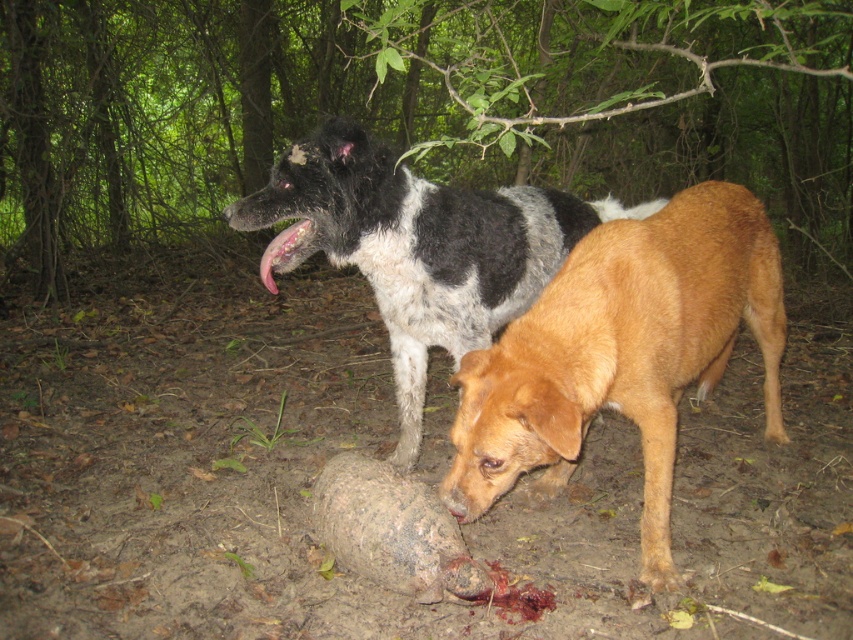
Who is positioned more to the right, green leafy forest at upper center or brown furry dog at lower center?

From the viewer's perspective, brown furry dog at lower center appears more on the right side.

Is green leafy forest at upper center above brown furry dog at lower center?

Correct, green leafy forest at upper center is located above brown furry dog at lower center.

Is point (186, 36) in front of point (637, 230)?

No, (186, 36) is further to viewer.

Identify the location of green leafy forest at upper center. (410, 104).

Between black and white fur dog at center and pink flesh at center, which one appears on the right side from the viewer's perspective?

black and white fur dog at center

Does black and white fur dog at center appear on the right side of pink flesh at center?

Yes, black and white fur dog at center is to the right of pink flesh at center.

Where is `black and white fur dog at center`? Image resolution: width=853 pixels, height=640 pixels. black and white fur dog at center is located at coordinates (422, 246).

At what (x,y) coordinates should I click in order to perform the action: click on black and white fur dog at center. Please return your answer as a coordinate pair (x, y). The width and height of the screenshot is (853, 640). Looking at the image, I should click on (422, 246).

How distant is green leafy forest at upper center from pink flesh at center?

5.63 meters

How much distance is there between green leafy forest at upper center and pink flesh at center?

green leafy forest at upper center is 18.48 feet from pink flesh at center.

Is point (19, 56) in front of point (268, 248)?

No.

Image resolution: width=853 pixels, height=640 pixels. I want to click on green leafy forest at upper center, so click(x=410, y=104).